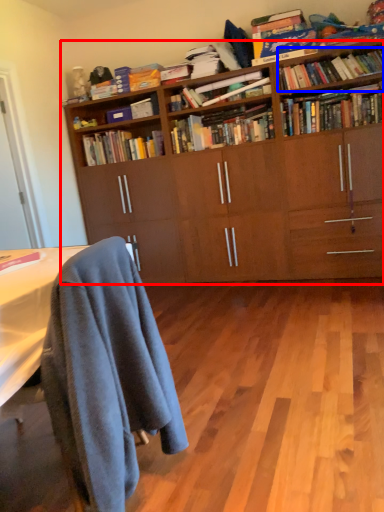
Question: Which object appears farthest to the camera in this image, bookcase (highlighted by a red box) or book (highlighted by a blue box)?

Choices:
 (A) bookcase
 (B) book

Answer: (B)